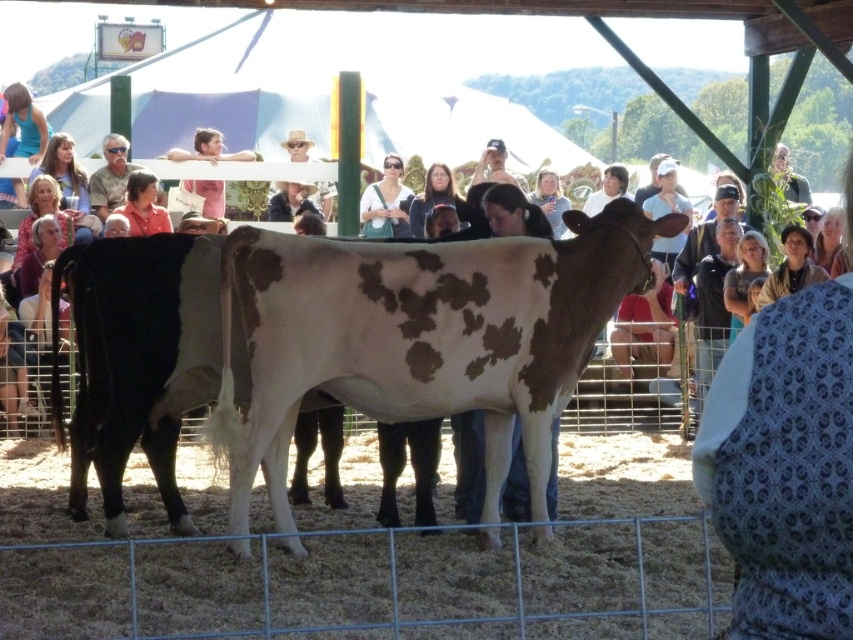
Question: Among these objects, which one is farthest from the camera?

Choices:
 (A) speckled white cow at center
 (B) matte white shirt at center
 (C) smooth skin face at upper center
 (D) white spotted fur at center

Answer: (B)

Question: Is matte white shirt at center smaller than smooth skin face at upper center?

Choices:
 (A) no
 (B) yes

Answer: (B)

Question: Does speckled white cow at center appear on the left side of matte white shirt at center?

Choices:
 (A) no
 (B) yes

Answer: (B)

Question: Estimate the real-world distances between objects in this image. Which object is closer to the matte white shirt at center?

Choices:
 (A) white spotted fur at center
 (B) smooth skin face at upper center
 (C) speckled white cow at center

Answer: (B)

Question: Is white spotted fur at center above matte white shirt at center?

Choices:
 (A) no
 (B) yes

Answer: (A)

Question: Which point is farther to the camera?

Choices:
 (A) matte white shirt at center
 (B) white spotted fur at center

Answer: (A)